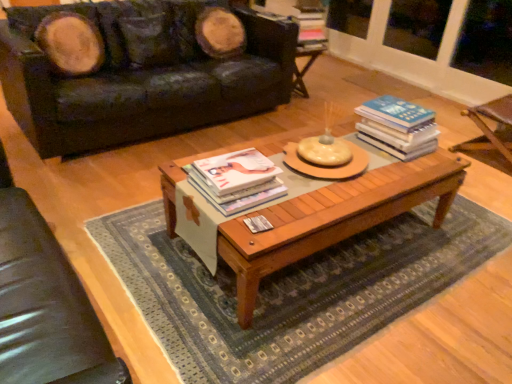
This screenshot has height=384, width=512. I want to click on vacant space situated above matte white book at center, the first book when ordered from left to right (from a real-world perspective), so click(228, 164).